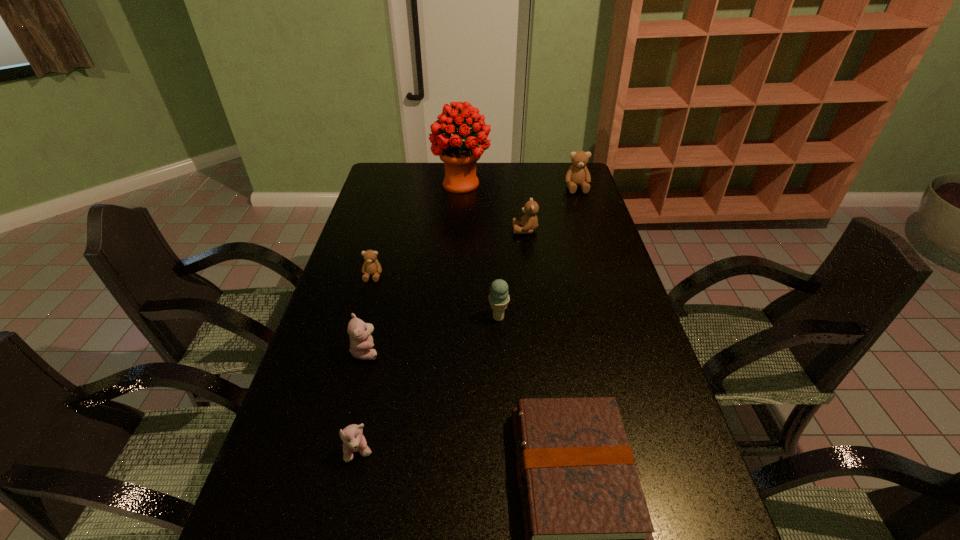
Where is `vacant space at the far right corner of the desktop`? The image size is (960, 540). vacant space at the far right corner of the desktop is located at coordinates (578, 188).

What are the coordinates of `unoccupied position between the fourth farthest object and the nearest teddy bear` in the screenshot? It's located at (366, 364).

Locate an element on the screen. This screenshot has width=960, height=540. unoccupied position between the tallest object and the farthest teddy bear is located at coordinates (519, 186).

This screenshot has width=960, height=540. I want to click on vacant point located between the farthest brown teddy bear and the nearest brown teddy bear, so click(x=475, y=232).

The width and height of the screenshot is (960, 540). I want to click on unoccupied position between the sixth farthest object and the rightmost brown teddy bear, so click(471, 269).

Locate an element on the screen. unoccupied position between the farther pink teddy bear and the tallest object is located at coordinates (414, 267).

The width and height of the screenshot is (960, 540). In order to click on object that stands as the fifth closest to the nearest teddy bear in this screenshot , I will do `click(529, 222)`.

Locate an element on the screen. This screenshot has width=960, height=540. the seventh closest object to the tallest object is located at coordinates (352, 436).

Identify which teddy bear is the second nearest to the bouquet. Please provide its 2D coordinates. Your answer should be formatted as a tuple, i.e. [(x, y)], where the tuple contains the x and y coordinates of a point satisfying the conditions above.

[(577, 175)]

The image size is (960, 540). I want to click on teddy bear that stands as the fourth closest to the nearest teddy bear, so click(x=577, y=175).